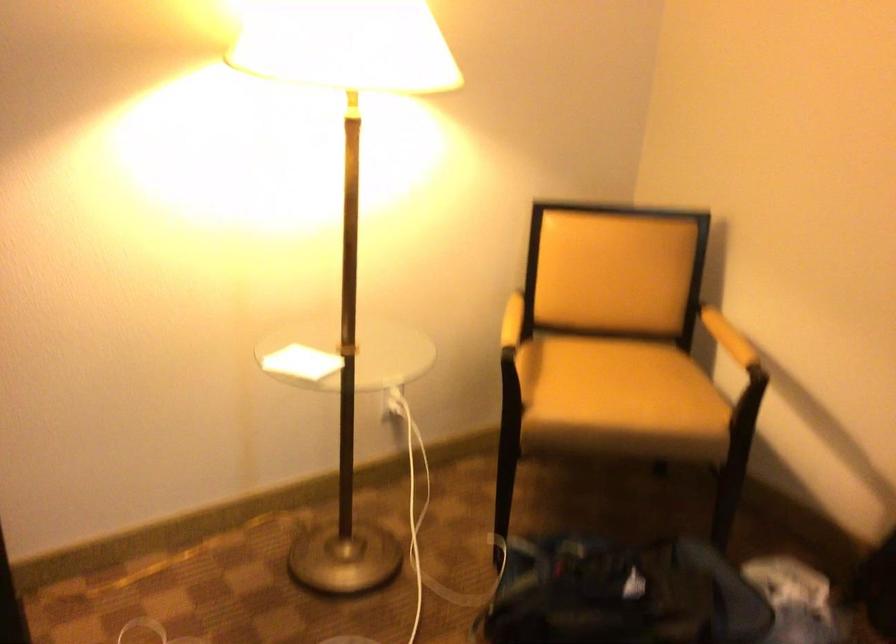
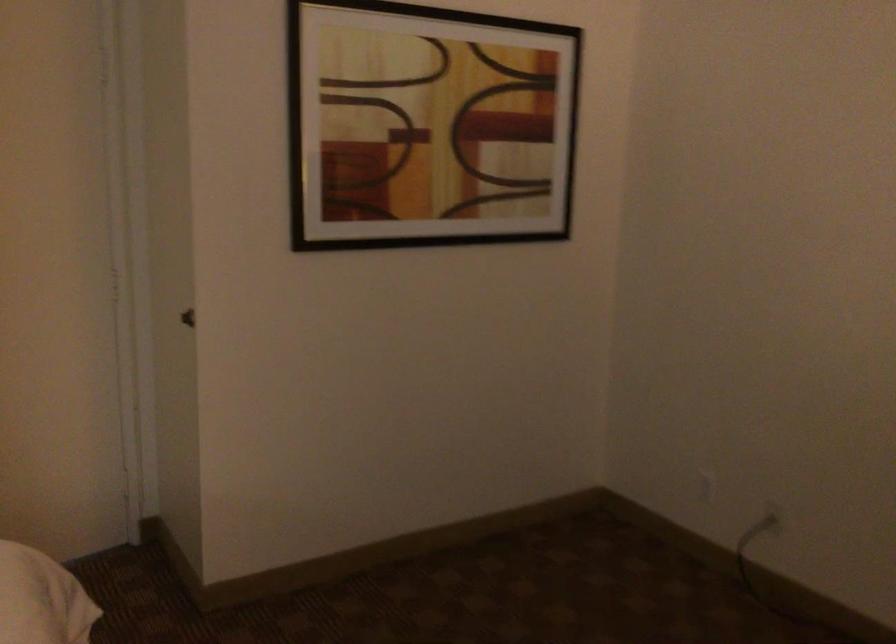
Question: How did the camera likely rotate?

Choices:
 (A) Left
 (B) Right
 (C) Up
 (D) Down

Answer: (A)